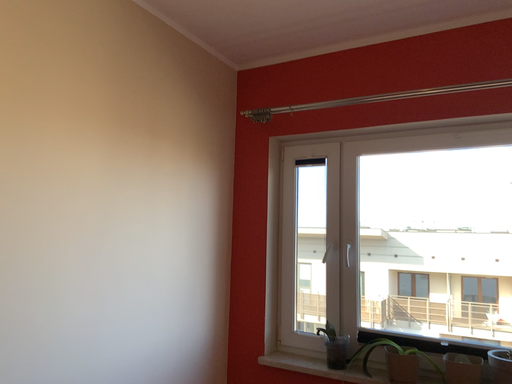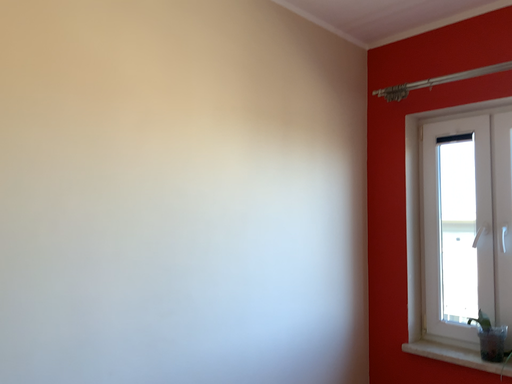
Question: Which way did the camera rotate in the video?

Choices:
 (A) rotated left
 (B) rotated right

Answer: (A)